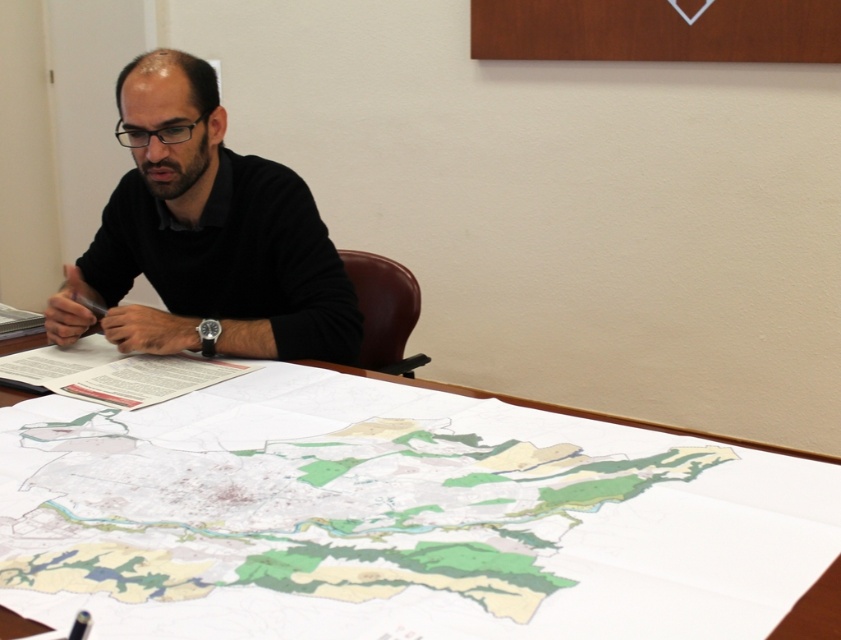
You are an observer looking at the man and the map. Which object is shorter in height between the white paper map at center and the black matte shirt at upper left?

The white paper map at center has a lesser height compared to the black matte shirt at upper left, so the white paper map at center is shorter in height.

You are a photographer standing at a distance. You want to take a photo of the white paper map at center. If your camera can focus on objects within 20 inches, will you need to move closer or farther away to capture it clearly?

The white paper map at center is 21.82 inches away from the camera. Since the camera can focus on objects within 20 inches, you need to move closer to ensure the white paper map at center is within the focus range.